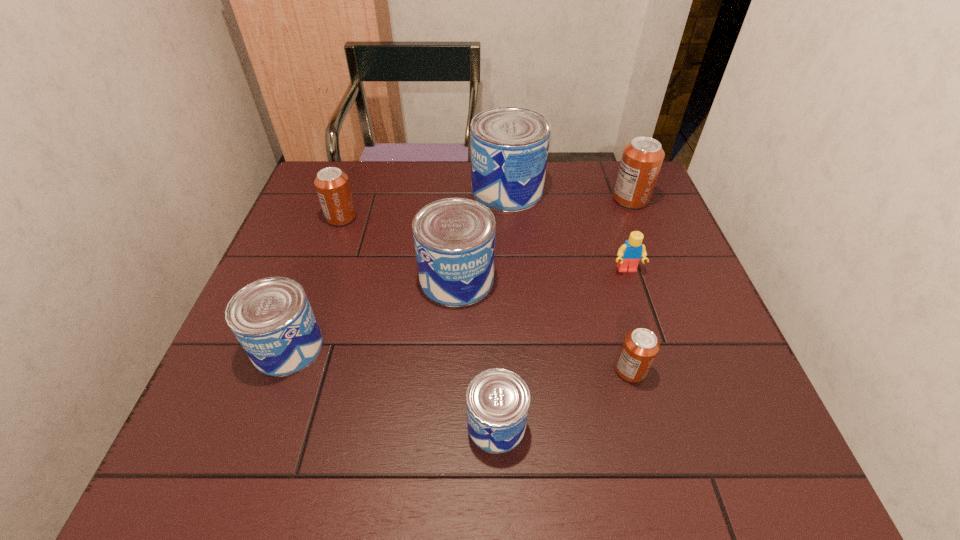
The width and height of the screenshot is (960, 540). I want to click on free space that is in between the nearest blue can and the leftmost blue can, so click(x=393, y=386).

Where is `vacant space that is in between the second smallest orange can and the third smallest blue can`? vacant space that is in between the second smallest orange can and the third smallest blue can is located at coordinates (399, 248).

Find the location of a particular element. The height and width of the screenshot is (540, 960). vacant space that's between the nearest blue can and the Lego is located at coordinates (562, 347).

The height and width of the screenshot is (540, 960). What are the coordinates of `free space between the farthest blue can and the third farthest blue can` in the screenshot? It's located at (397, 269).

Locate which object ranks seventh in proximity to the biggest orange can. Please provide its 2D coordinates. Your answer should be formatted as a tuple, i.e. [(x, y)], where the tuple contains the x and y coordinates of a point satisfying the conditions above.

[(272, 319)]

Locate an element on the screen. Image resolution: width=960 pixels, height=540 pixels. object that stands as the fourth closest to the rightmost can is located at coordinates (640, 347).

Identify the location of can that is the second closest to the second smallest blue can. Image resolution: width=960 pixels, height=540 pixels. (497, 400).

Select which can is the fifth closest to the second biggest blue can. Please provide its 2D coordinates. Your answer should be formatted as a tuple, i.e. [(x, y)], where the tuple contains the x and y coordinates of a point satisfying the conditions above.

[(640, 347)]

This screenshot has height=540, width=960. Identify the location of blue can identified as the second closest to the second biggest blue can. (272, 319).

Find the location of `blue can that can be found as the closest to the Lego`. blue can that can be found as the closest to the Lego is located at coordinates (509, 145).